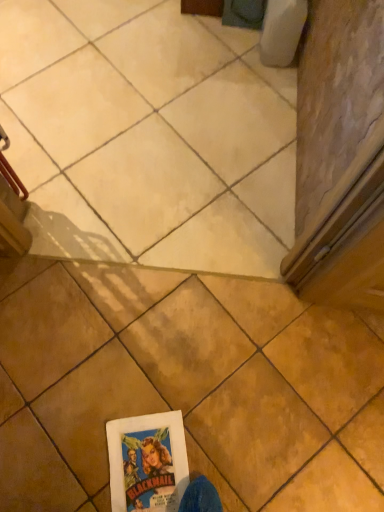
Describe the element at coordinates (148, 136) in the screenshot. I see `matte beige tile at center, acting as the 1th tile starting from the top` at that location.

In order to face matte beige tile at center, arranged as the 2th tile when ordered from the bottom, should I rotate leftwards or rightwards?

A 7.840 degree turn to the left will do.

This screenshot has height=512, width=384. Find the location of `matte beige tile at center, the 1th tile when ordered from back to front`. matte beige tile at center, the 1th tile when ordered from back to front is located at coordinates (148, 136).

Measure the distance between point (228, 70) and camera.

The distance of point (228, 70) from camera is 5.32 feet.

This screenshot has width=384, height=512. What are the coordinates of `brown matte tile at center, placed as the 2th tile when sorted from back to front` in the screenshot? It's located at (185, 386).

What do you see at coordinates (185, 386) in the screenshot?
I see `brown matte tile at center, the 2th tile in the top-to-bottom sequence` at bounding box center [185, 386].

Find the location of a particular element. The height and width of the screenshot is (512, 384). matte beige tile at center, arranged as the 2th tile when ordered from the bottom is located at coordinates (148, 136).

Is brown matte tile at center, which appears as the first tile when ordered from the bottom, to the left of matte beige tile at center, which is the second tile in front-to-back order, from the viewer's perspective?

Incorrect, brown matte tile at center, which appears as the first tile when ordered from the bottom, is not on the left side of matte beige tile at center, which is the second tile in front-to-back order.

Which object is closer to the camera taking this photo, brown matte tile at center, the 2th tile in the top-to-bottom sequence, or matte beige tile at center, arranged as the 2th tile when ordered from the bottom?

brown matte tile at center, the 2th tile in the top-to-bottom sequence.

Considering the points (382, 482) and (198, 220), which point is in front, point (382, 482) or point (198, 220)?

The point (382, 482) is in front.

From the image's perspective, does brown matte tile at center, the 1th tile when ordered from front to back, appear higher than matte beige tile at center, which is the second tile in front-to-back order?

Actually, brown matte tile at center, the 1th tile when ordered from front to back, appears below matte beige tile at center, which is the second tile in front-to-back order, in the image.

Looking at this image, from a real-world perspective, is brown matte tile at center, the 1th tile when ordered from front to back, on top of matte beige tile at center, the 1th tile when ordered from back to front?

Yes, from a real-world perspective, brown matte tile at center, the 1th tile when ordered from front to back, is above matte beige tile at center, the 1th tile when ordered from back to front.

Considering the sizes of brown matte tile at center, the 1th tile when ordered from front to back, and matte beige tile at center, acting as the 1th tile starting from the top, in the image, is brown matte tile at center, the 1th tile when ordered from front to back, wider or thinner than matte beige tile at center, acting as the 1th tile starting from the top,?

In the image, brown matte tile at center, the 1th tile when ordered from front to back, appears to be more narrow than matte beige tile at center, acting as the 1th tile starting from the top.

Considering the sizes of objects brown matte tile at center, which appears as the first tile when ordered from the bottom, and matte beige tile at center, which is the second tile in front-to-back order, in the image provided, who is shorter, brown matte tile at center, which appears as the first tile when ordered from the bottom, or matte beige tile at center, which is the second tile in front-to-back order,?

matte beige tile at center, which is the second tile in front-to-back order.

Does brown matte tile at center, which appears as the first tile when ordered from the bottom, have a larger size compared to matte beige tile at center, the 1th tile when ordered from back to front?

Yes, brown matte tile at center, which appears as the first tile when ordered from the bottom, is bigger than matte beige tile at center, the 1th tile when ordered from back to front.

Is brown matte tile at center, which appears as the first tile when ordered from the bottom, inside the boundaries of matte beige tile at center, arranged as the 2th tile when ordered from the bottom, or outside?

brown matte tile at center, which appears as the first tile when ordered from the bottom, is located beyond the bounds of matte beige tile at center, arranged as the 2th tile when ordered from the bottom.

From the picture: Does brown matte tile at center, the 2th tile in the top-to-bottom sequence, touch matte beige tile at center, which is the second tile in front-to-back order?

No.

Is brown matte tile at center, the 1th tile when ordered from front to back, turned away from matte beige tile at center, the 1th tile when ordered from back to front?

brown matte tile at center, the 1th tile when ordered from front to back, does not have its back to matte beige tile at center, the 1th tile when ordered from back to front.

How many degrees apart are the facing directions of brown matte tile at center, which appears as the first tile when ordered from the bottom, and matte beige tile at center, the 1th tile when ordered from back to front?

brown matte tile at center, which appears as the first tile when ordered from the bottom, and matte beige tile at center, the 1th tile when ordered from back to front, are facing 180 degrees away from each other.

Where is `tile located on the right of matte beige tile at center, which is the second tile in front-to-back order`? tile located on the right of matte beige tile at center, which is the second tile in front-to-back order is located at coordinates (185, 386).

Consider the image. Would you say matte beige tile at center, arranged as the 2th tile when ordered from the bottom, is to the left or to the right of brown matte tile at center, which appears as the first tile when ordered from the bottom, in the picture?

Based on their positions, matte beige tile at center, arranged as the 2th tile when ordered from the bottom, is located to the left of brown matte tile at center, which appears as the first tile when ordered from the bottom.

Is matte beige tile at center, acting as the 1th tile starting from the top, in front of or behind brown matte tile at center, the 1th tile when ordered from front to back, in the image?

Visually, matte beige tile at center, acting as the 1th tile starting from the top, is located behind brown matte tile at center, the 1th tile when ordered from front to back.

Considering the points (222, 132) and (315, 416), which point is behind, point (222, 132) or point (315, 416)?

The point (222, 132) is farther.

Looking at this image, from the image's perspective, which one is positioned lower, matte beige tile at center, arranged as the 2th tile when ordered from the bottom, or brown matte tile at center, placed as the 2th tile when sorted from back to front?

brown matte tile at center, placed as the 2th tile when sorted from back to front.

From a real-world perspective, is matte beige tile at center, arranged as the 2th tile when ordered from the bottom, on top of brown matte tile at center, the 2th tile in the top-to-bottom sequence?

No, from a real-world perspective, matte beige tile at center, arranged as the 2th tile when ordered from the bottom, is not above brown matte tile at center, the 2th tile in the top-to-bottom sequence.

Is matte beige tile at center, acting as the 1th tile starting from the top, wider than brown matte tile at center, placed as the 2th tile when sorted from back to front?

Correct, the width of matte beige tile at center, acting as the 1th tile starting from the top, exceeds that of brown matte tile at center, placed as the 2th tile when sorted from back to front.

Which of these two, matte beige tile at center, the 1th tile when ordered from back to front, or brown matte tile at center, placed as the 2th tile when sorted from back to front, stands taller?

Standing taller between the two is brown matte tile at center, placed as the 2th tile when sorted from back to front.

Consider the image. Between matte beige tile at center, the 1th tile when ordered from back to front, and brown matte tile at center, which appears as the first tile when ordered from the bottom, which one has smaller size?

matte beige tile at center, the 1th tile when ordered from back to front.

Is matte beige tile at center, which is the second tile in front-to-back order, outside of brown matte tile at center, placed as the 2th tile when sorted from back to front?

matte beige tile at center, which is the second tile in front-to-back order, lies outside brown matte tile at center, placed as the 2th tile when sorted from back to front,'s area.

Are matte beige tile at center, arranged as the 2th tile when ordered from the bottom, and brown matte tile at center, placed as the 2th tile when sorted from back to front, far apart?

matte beige tile at center, arranged as the 2th tile when ordered from the bottom, is actually quite close to brown matte tile at center, placed as the 2th tile when sorted from back to front.

Is matte beige tile at center, the 1th tile when ordered from back to front, looking in the opposite direction of brown matte tile at center, which appears as the first tile when ordered from the bottom?

matte beige tile at center, the 1th tile when ordered from back to front, is not turned away from brown matte tile at center, which appears as the first tile when ordered from the bottom.

Can you tell me how much matte beige tile at center, which is the second tile in front-to-back order, and brown matte tile at center, which appears as the first tile when ordered from the bottom, differ in facing direction?

180 degrees separate the facing orientations of matte beige tile at center, which is the second tile in front-to-back order, and brown matte tile at center, which appears as the first tile when ordered from the bottom.

How much distance is there between matte beige tile at center, which is the second tile in front-to-back order, and brown matte tile at center, the 1th tile when ordered from front to back?

They are 48.68 centimeters apart.

Identify the location of tile in front of the matte beige tile at center, arranged as the 2th tile when ordered from the bottom. This screenshot has width=384, height=512. (185, 386).

The image size is (384, 512). I want to click on tile above the brown matte tile at center, the 1th tile when ordered from front to back (from the image's perspective), so click(148, 136).

Where is `tile below the brown matte tile at center, placed as the 2th tile when sorted from back to front (from a real-world perspective)`? The height and width of the screenshot is (512, 384). tile below the brown matte tile at center, placed as the 2th tile when sorted from back to front (from a real-world perspective) is located at coordinates (148, 136).